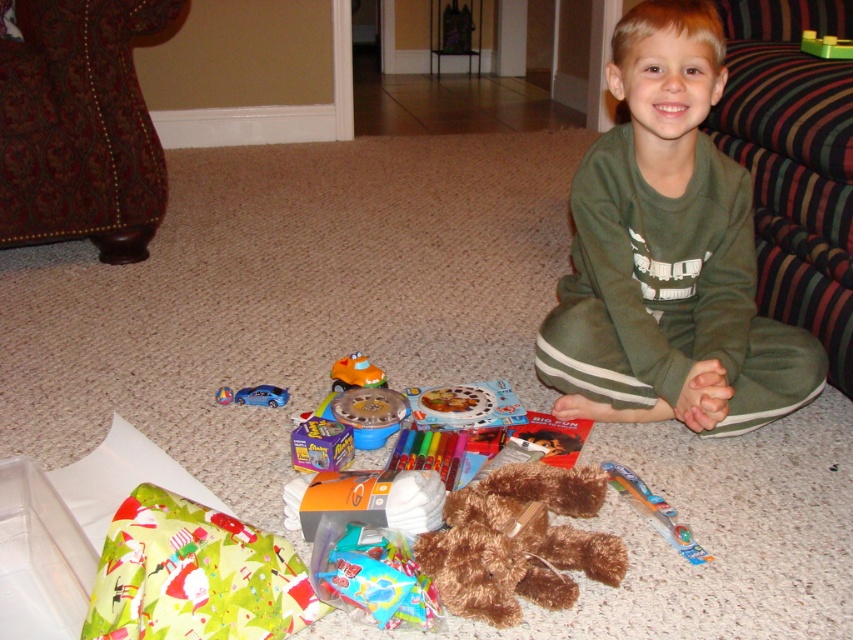
You are a parent trying to organize the child play area. The orange plastic toy car at center and the metallic blue car at lower left are blocking the path to the bathroom. Which car should you move first to clear the path?

The metallic blue car at lower left should be moved first because the orange plastic toy car at center is located above it, meaning the metallic blue car is lower and closer to the path.